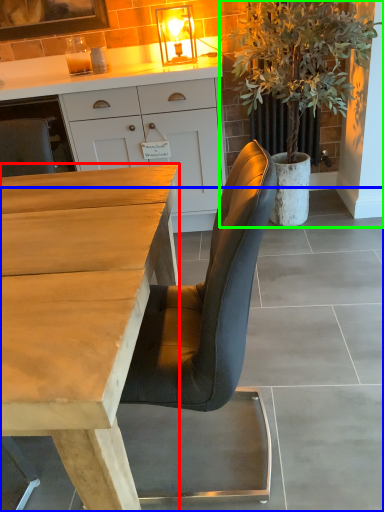
Question: Which is nearer to the desk (highlighted by a red box)? concrete (highlighted by a blue box) or houseplant (highlighted by a green box).

Choices:
 (A) concrete
 (B) houseplant

Answer: (A)